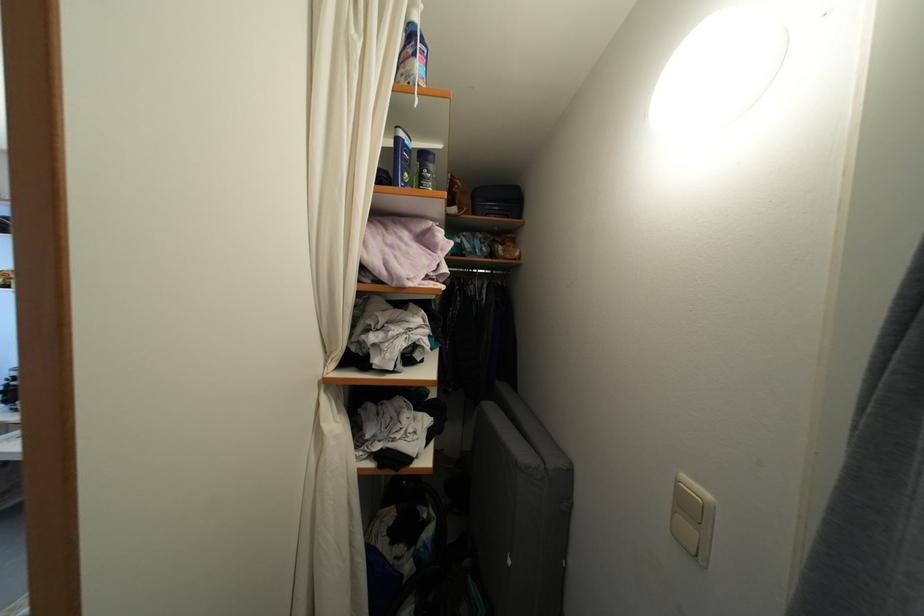
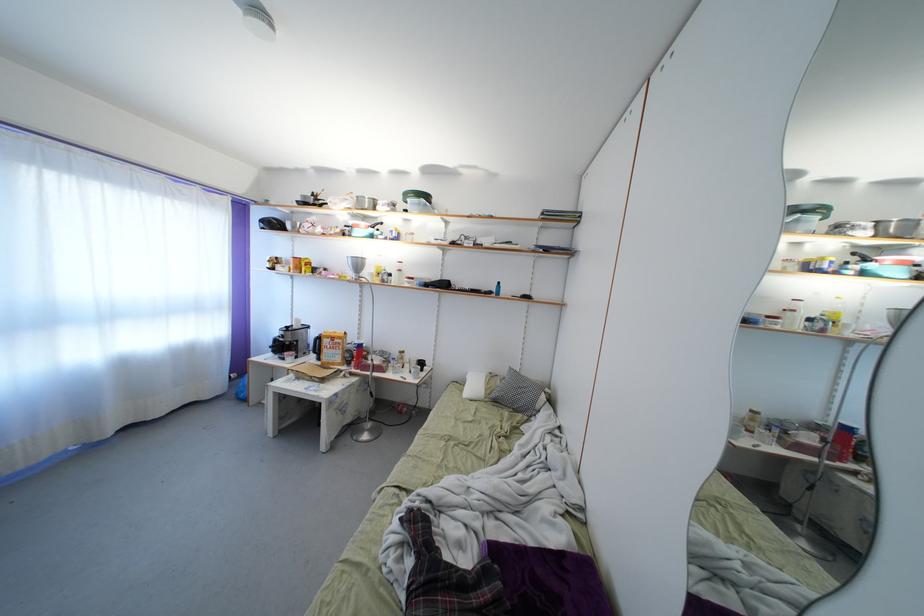
Question: In a continuous first-person perspective shot, in which direction is the camera moving?

Choices:
 (A) Left
 (B) Right
 (C) Forward
 (D) Backward

Answer: (A)